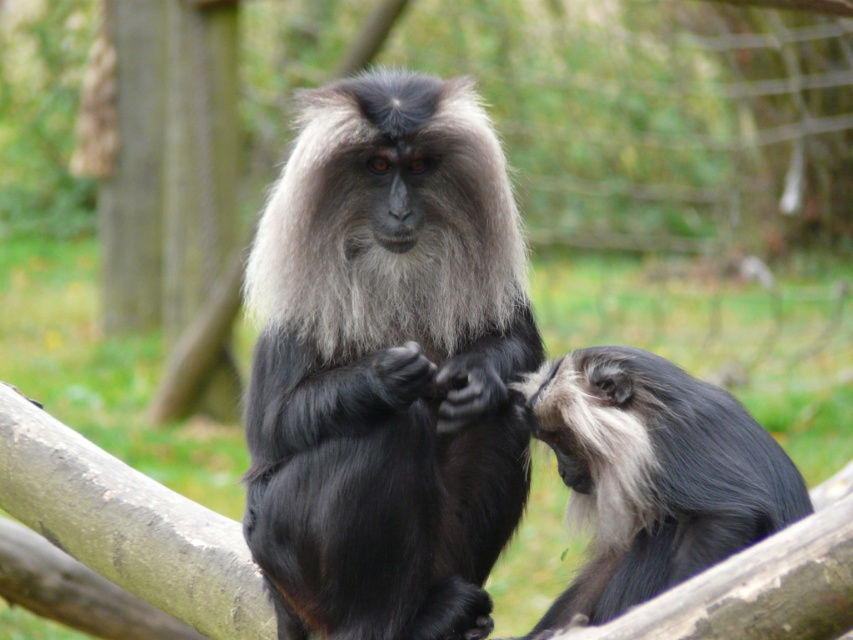
You are a zookeeper observing two monkeys in their enclosure. You notice a banana placed between them. Which monkey is closer to the banana if it is located exactly halfway between the black fur monkey at center and the gray fur monkey at right?

The banana is exactly halfway between the black fur monkey at center and the gray fur monkey at right, so both monkeys are equally close to the banana.

You are a zookeeper observing the monkeys in their enclosure. You need to determine which monkey is closer to you. The monkeys are the black fur monkey at center and the gray fur monkey at right. Which one is closer?

The black fur monkey at center is closer to you because it is further to the viewer than the gray fur monkey at right.

You are a zookeeper observing two monkeys in their enclosure. You notice a black fur monkey at center and a gray fur monkey at right. Based on their sizes, which monkey would require a larger feeding bowl to accommodate its size?

The black fur monkey at center requires a larger feeding bowl because it has a larger size compared to the gray fur monkey at right.